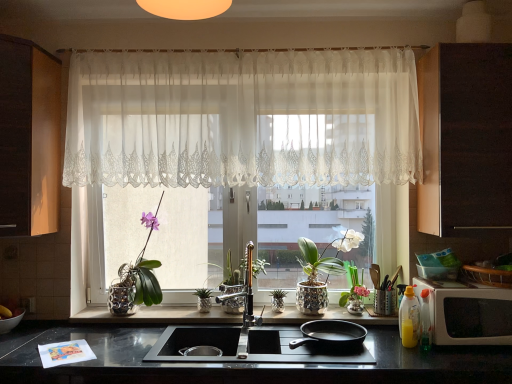
Question: From the image's perspective, is matte wood cabinet at left, the second cabinetry in the right-to-left sequence, under green metallic pineapple at center, marked as the second plant in a left-to-right arrangement?

Choices:
 (A) yes
 (B) no

Answer: (B)

Question: Is matte wood cabinet at left, positioned as the 1th cabinetry in left-to-right order, at the right side of green metallic pineapple at center, marked as the second plant in a left-to-right arrangement?

Choices:
 (A) yes
 (B) no

Answer: (B)

Question: Does matte wood cabinet at left, the second cabinetry in the right-to-left sequence, have a smaller size compared to green metallic pineapple at center, marked as the second plant in a left-to-right arrangement?

Choices:
 (A) no
 (B) yes

Answer: (A)

Question: Does matte wood cabinet at left, positioned as the 1th cabinetry in left-to-right order, touch green metallic pineapple at center, marked as the second plant in a left-to-right arrangement?

Choices:
 (A) no
 (B) yes

Answer: (A)

Question: Is matte wood cabinet at left, positioned as the 1th cabinetry in left-to-right order, at the left side of green metallic pineapple at center, marked as the second plant in a left-to-right arrangement?

Choices:
 (A) yes
 (B) no

Answer: (A)

Question: In the image, is metallic silver pot at center, which is the first plant from left to right, positioned in front of or behind black granite countertop at lower center?

Choices:
 (A) front
 (B) behind

Answer: (B)

Question: Choose the correct answer: Is metallic silver pot at center, positioned as the second plant in right-to-left order, inside black granite countertop at lower center or outside it?

Choices:
 (A) outside
 (B) inside

Answer: (A)

Question: From a real-world perspective, is metallic silver pot at center, positioned as the second plant in right-to-left order, physically located above or below black granite countertop at lower center?

Choices:
 (A) below
 (B) above

Answer: (B)

Question: In terms of size, does metallic silver pot at center, which is the first plant from left to right, appear bigger or smaller than black granite countertop at lower center?

Choices:
 (A) big
 (B) small

Answer: (B)

Question: From the image's perspective, is metallic silver pot at center, positioned as the second plant in right-to-left order, above or below sheer white lace curtain at center?

Choices:
 (A) below
 (B) above

Answer: (A)

Question: Does point (210, 246) appear closer or farther from the camera than point (284, 180)?

Choices:
 (A) farther
 (B) closer

Answer: (A)

Question: Would you say metallic silver pot at center, which is the first plant from left to right, is to the left or to the right of sheer white lace curtain at center in the picture?

Choices:
 (A) right
 (B) left

Answer: (B)

Question: Relative to sheer white lace curtain at center, is metallic silver pot at center, positioned as the second plant in right-to-left order, in front or behind?

Choices:
 (A) front
 (B) behind

Answer: (B)

Question: Is dark wood cabinet at right, marked as the 2th cabinetry in a left-to-right arrangement, spatially inside sheer white lace curtain at center, or outside of it?

Choices:
 (A) outside
 (B) inside

Answer: (A)

Question: Looking at their shapes, would you say dark wood cabinet at right, the 1th cabinetry from the right, is wider or thinner than sheer white lace curtain at center?

Choices:
 (A) wide
 (B) thin

Answer: (A)